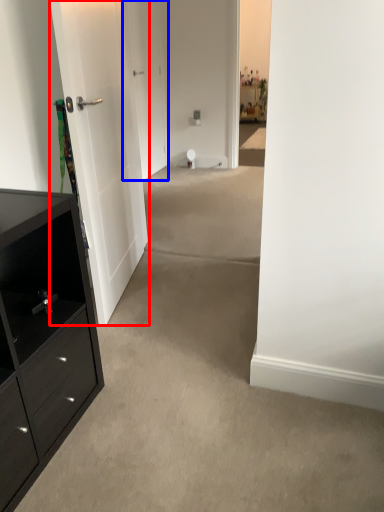
Question: Which point is closer to the camera, door (highlighted by a red box) or door (highlighted by a blue box)?

Choices:
 (A) door
 (B) door

Answer: (A)